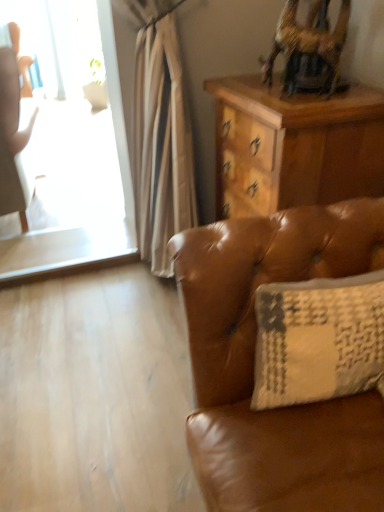
Question: Does matte white chair at left turn towards wooden desk at upper right?

Choices:
 (A) yes
 (B) no

Answer: (B)

Question: Considering the relative sizes of matte white chair at left and wooden desk at upper right in the image provided, is matte white chair at left shorter than wooden desk at upper right?

Choices:
 (A) no
 (B) yes

Answer: (A)

Question: Is matte white chair at left wider than wooden desk at upper right?

Choices:
 (A) no
 (B) yes

Answer: (B)

Question: Would you say matte white chair at left is a long distance from wooden desk at upper right?

Choices:
 (A) yes
 (B) no

Answer: (A)

Question: From a real-world perspective, is matte white chair at left on wooden desk at upper right?

Choices:
 (A) yes
 (B) no

Answer: (B)

Question: Considering the positions of wooden swivel chair at upper right and matte white chair at left in the image, is wooden swivel chair at upper right taller or shorter than matte white chair at left?

Choices:
 (A) tall
 (B) short

Answer: (B)

Question: Is point (329, 71) closer or farther from the camera than point (14, 147)?

Choices:
 (A) farther
 (B) closer

Answer: (B)

Question: In the image, is wooden swivel chair at upper right on the left side or the right side of matte white chair at left?

Choices:
 (A) right
 (B) left

Answer: (A)

Question: From a real-world perspective, relative to matte white chair at left, is wooden swivel chair at upper right vertically above or below?

Choices:
 (A) below
 (B) above

Answer: (B)

Question: Is wooden desk at upper right to the left or to the right of matte white chair at left in the image?

Choices:
 (A) right
 (B) left

Answer: (A)

Question: From the image's perspective, is wooden desk at upper right located above or below matte white chair at left?

Choices:
 (A) below
 (B) above

Answer: (A)

Question: Considering their positions, is wooden desk at upper right located in front of or behind matte white chair at left?

Choices:
 (A) front
 (B) behind

Answer: (A)

Question: Looking at their shapes, would you say wooden desk at upper right is wider or thinner than matte white chair at left?

Choices:
 (A) thin
 (B) wide

Answer: (A)

Question: Is point (380, 334) positioned closer to the camera than point (294, 3)?

Choices:
 (A) farther
 (B) closer

Answer: (B)

Question: Considering the positions of beige textured pillow at right and wooden swivel chair at upper right in the image, is beige textured pillow at right bigger or smaller than wooden swivel chair at upper right?

Choices:
 (A) small
 (B) big

Answer: (B)